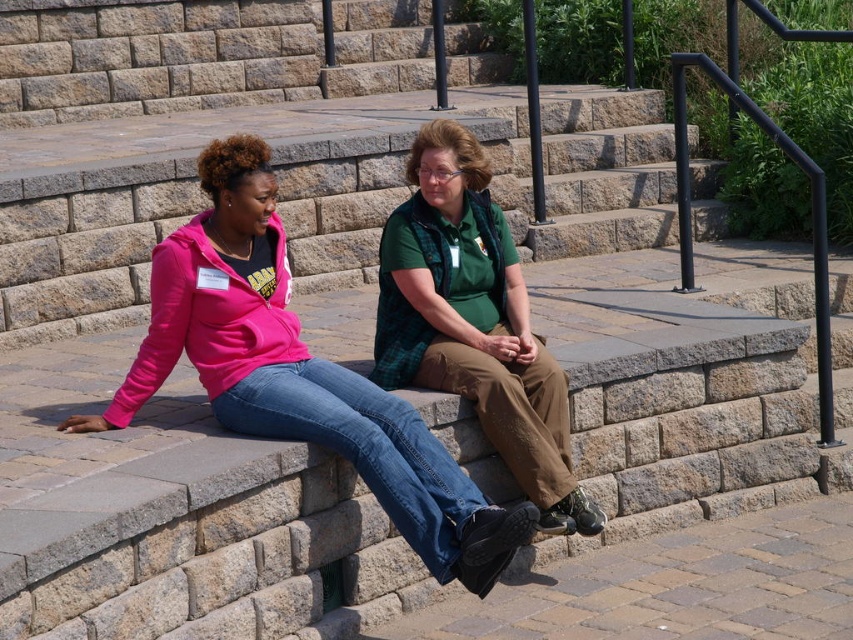
Question: Can you confirm if matte pink hoodie at center is positioned to the right of green plaid shirt at center?

Choices:
 (A) no
 (B) yes

Answer: (A)

Question: Which object is closer to the camera taking this photo?

Choices:
 (A) matte pink hoodie at center
 (B) green plaid shirt at center

Answer: (A)

Question: From the image, what is the correct spatial relationship of matte pink hoodie at center in relation to green plaid shirt at center?

Choices:
 (A) left
 (B) right

Answer: (A)

Question: Which object is closer to the camera taking this photo?

Choices:
 (A) green plaid shirt at center
 (B) matte pink hoodie at center

Answer: (B)

Question: Which point appears farthest from the camera in this image?

Choices:
 (A) (412, 522)
 (B) (527, 444)

Answer: (B)

Question: Is matte pink hoodie at center wider than green plaid shirt at center?

Choices:
 (A) no
 (B) yes

Answer: (B)